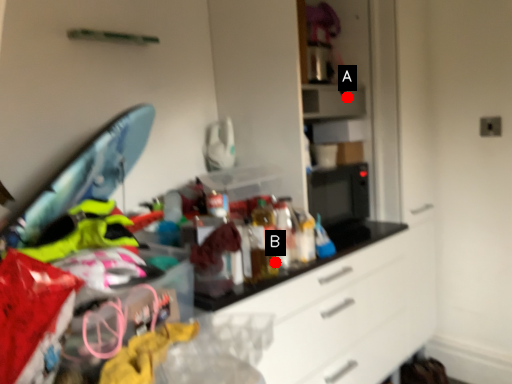
Question: Two points are circled on the image, labeled by A and B beside each circle. Among these points, which one is nearest to the camera?

Choices:
 (A) A is closer
 (B) B is closer

Answer: (B)